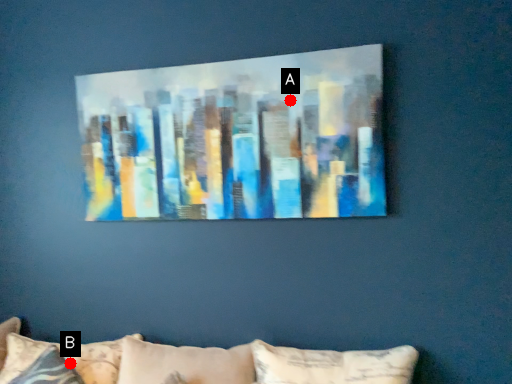
Question: Two points are circled on the image, labeled by A and B beside each circle. Among these points, which one is farthest from the camera?

Choices:
 (A) A is further
 (B) B is further

Answer: (B)